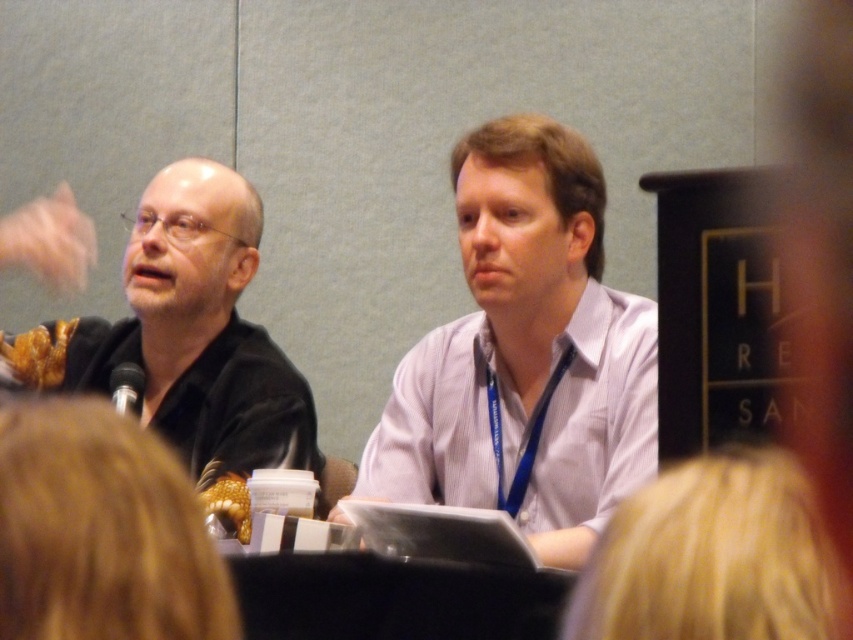
Question: Can you confirm if matte purple shirt at center is positioned above black matte shirt at left?

Choices:
 (A) yes
 (B) no

Answer: (A)

Question: Which of the following is the closest to the observer?

Choices:
 (A) black matte shirt at left
 (B) matte purple shirt at center

Answer: (B)

Question: Among these points, which one is farthest from the camera?

Choices:
 (A) (561, 378)
 (B) (260, 408)

Answer: (B)

Question: Which object appears farthest from the camera in this image?

Choices:
 (A) matte purple shirt at center
 (B) black matte shirt at left

Answer: (B)

Question: Is matte purple shirt at center smaller than black matte shirt at left?

Choices:
 (A) no
 (B) yes

Answer: (B)

Question: In this image, where is matte purple shirt at center located relative to black matte shirt at left?

Choices:
 (A) right
 (B) left

Answer: (A)